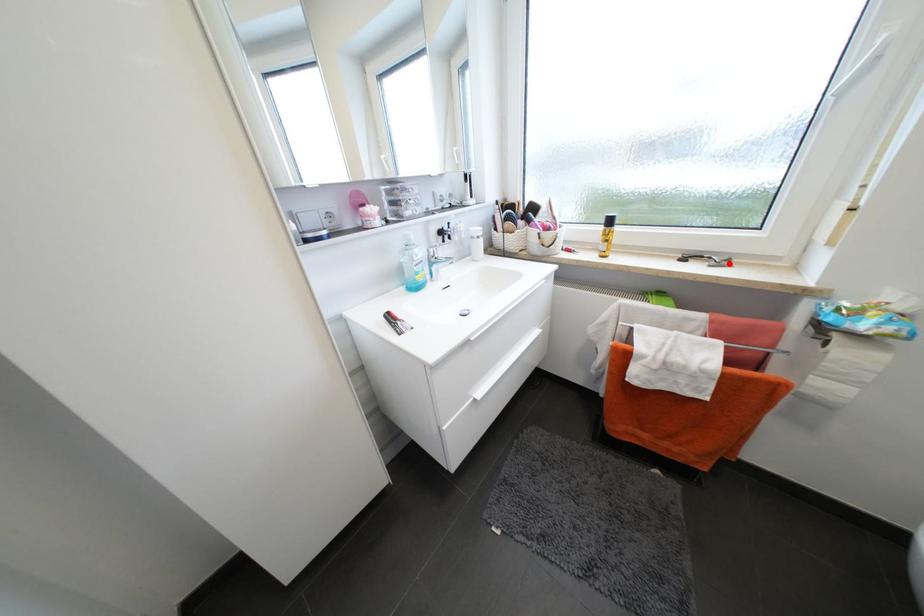
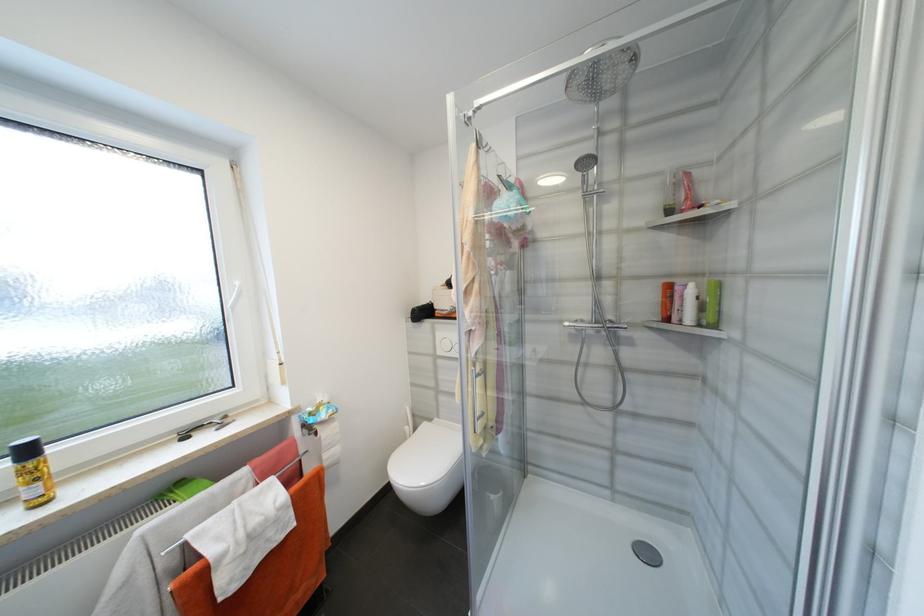
The point at the highlighted location is marked in the first image. Where is the corresponding point in the second image?

(228, 422)